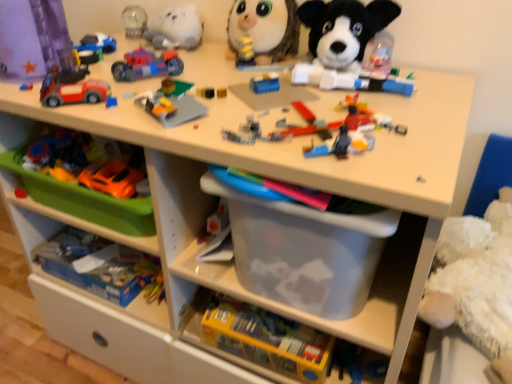
The width and height of the screenshot is (512, 384). Find the location of `vacant region to the left of soft plush dog at upper center, which is the seventh toy from bottom to top`. vacant region to the left of soft plush dog at upper center, which is the seventh toy from bottom to top is located at coordinates (250, 81).